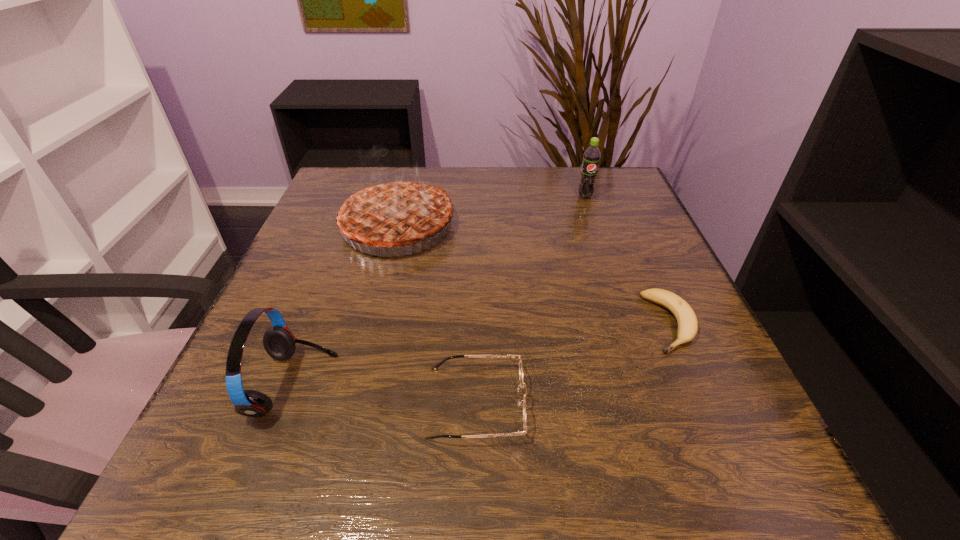
The image size is (960, 540). I want to click on the tallest object, so click(390, 212).

The image size is (960, 540). I want to click on the second object from right to left, so tap(591, 158).

Image resolution: width=960 pixels, height=540 pixels. What are the coordinates of `headset` in the screenshot? It's located at (280, 344).

Image resolution: width=960 pixels, height=540 pixels. I want to click on the fourth tallest object, so click(437, 366).

Where is `banana`? The image size is (960, 540). banana is located at coordinates (687, 321).

At what (x,y) coordinates should I click in order to perform the action: click on the rightmost object. Please return your answer as a coordinate pair (x, y). Image resolution: width=960 pixels, height=540 pixels. Looking at the image, I should click on (687, 321).

Locate an element on the screen. The image size is (960, 540). vacant space located on the right of the pie is located at coordinates (609, 226).

Find the location of a particular element. This screenshot has width=960, height=540. vacant region located on the front label of the fourth object from left to right is located at coordinates tap(628, 319).

You are a GUI agent. You are given a task and a screenshot of the screen. Output one action in this format:
    pyautogui.click(x=<x>, y=<y>)
    Task: Click on the vacant space situated 0.320m with the microphone attached to the side of the third tallest object
    
    Given the screenshot: What is the action you would take?
    pyautogui.click(x=537, y=385)

Identify the location of free space located on the lenses of the second shortest object. This screenshot has height=540, width=960. (673, 403).